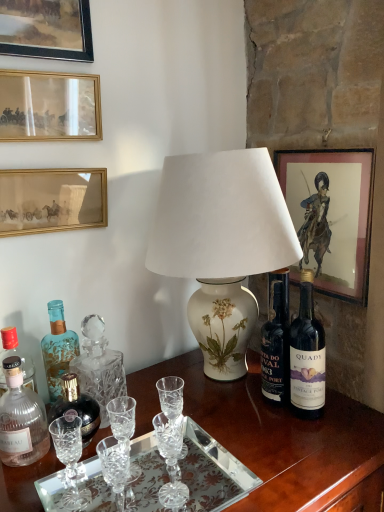
Identify the location of vacant point to the right of dark glass bottle at right. (349, 418).